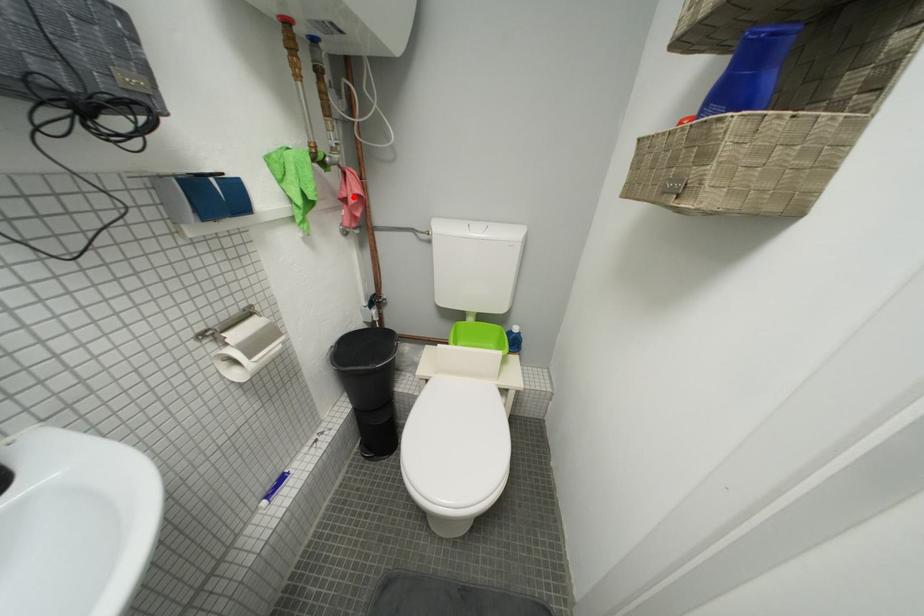
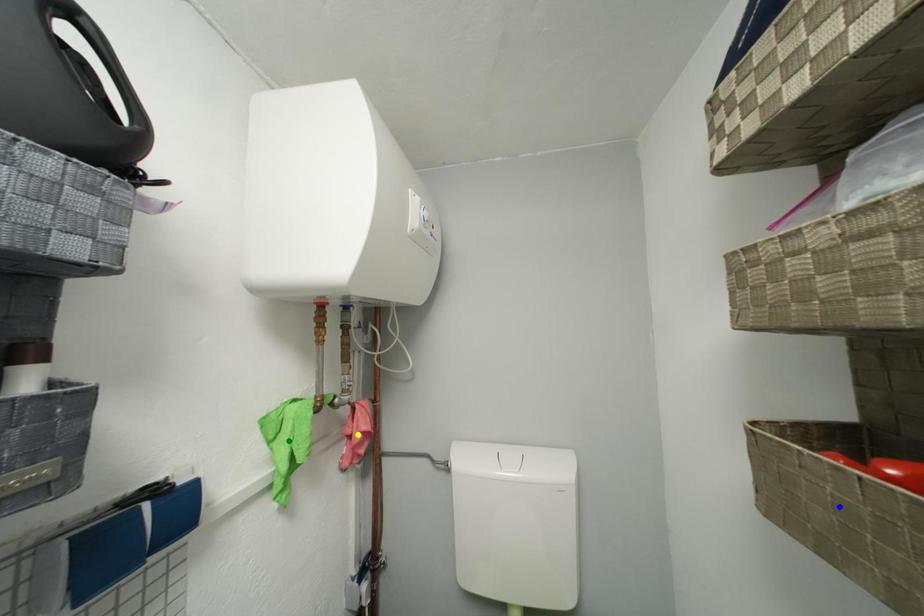
Question: I am providing you with two images of the same scene from different viewpoints. A red point is marked on the first image. You are given multiple points on the second image. Which spot in image 2 lines up with the point in image 1?

Choices:
 (A) blue point
 (B) green point
 (C) yellow point

Answer: (C)